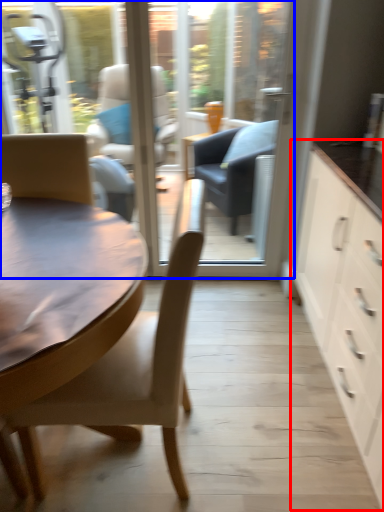
Question: Which point is further to the camera, cabinetry (highlighted by a red box) or window screen (highlighted by a blue box)?

Choices:
 (A) cabinetry
 (B) window screen

Answer: (B)